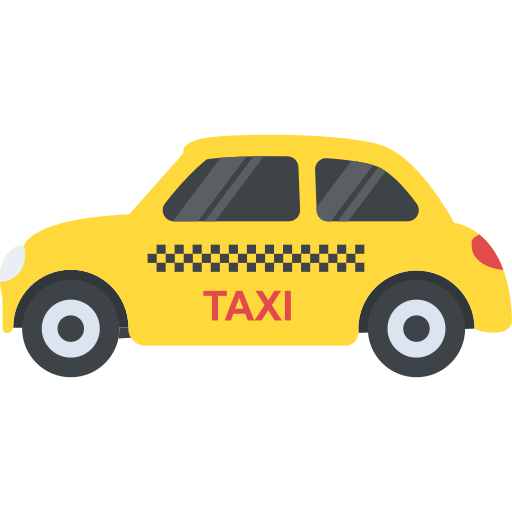
Identify the location of gap between windows. (307, 195).